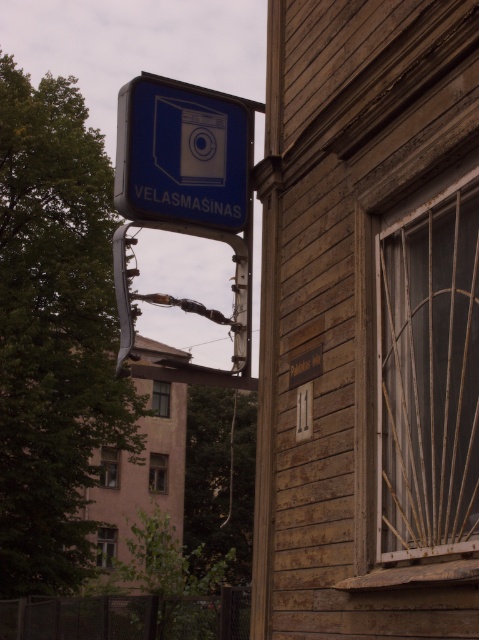
In the scene shown: You are standing in front of the wooden building and want to locate the wooden lattice window at right. Can you tell me its coordinates?

The wooden lattice window at right is located at coordinates point (420,372).

You are a delivery person trying to locate the entrance to the building. The entrance is below the wooden lattice window at right. Is the entrance also below the blue plastic sign at upper left?

The wooden lattice window at right is below the blue plastic sign at upper left, so the entrance is also below the blue plastic sign at upper left.